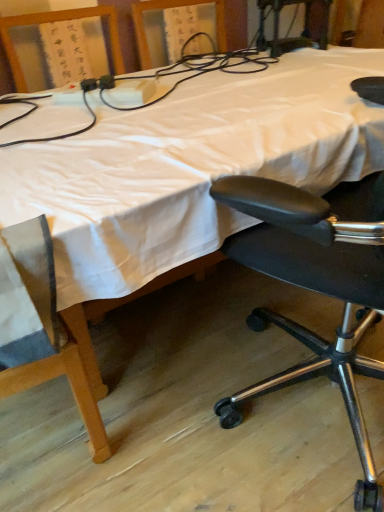
Question: From the image's perspective, would you say black leather office chair at right is positioned over white plastic power strip at upper left?

Choices:
 (A) no
 (B) yes

Answer: (A)

Question: Is black leather office chair at right positioned behind white plastic power strip at upper left?

Choices:
 (A) yes
 (B) no

Answer: (B)

Question: Is black leather office chair at right to the right of white plastic power strip at upper left from the viewer's perspective?

Choices:
 (A) yes
 (B) no

Answer: (A)

Question: Is black leather office chair at right completely or partially outside of white plastic power strip at upper left?

Choices:
 (A) yes
 (B) no

Answer: (A)

Question: Considering the relative sizes of black leather office chair at right and white plastic power strip at upper left in the image provided, is black leather office chair at right wider than white plastic power strip at upper left?

Choices:
 (A) yes
 (B) no

Answer: (A)

Question: Does black leather office chair at right have a lesser width compared to white plastic power strip at upper left?

Choices:
 (A) no
 (B) yes

Answer: (A)

Question: Does white plastic power strip at upper left appear on the left side of black leather office chair at right?

Choices:
 (A) no
 (B) yes

Answer: (B)

Question: Can you confirm if white plastic power strip at upper left is bigger than black leather office chair at right?

Choices:
 (A) yes
 (B) no

Answer: (B)

Question: Is white plastic power strip at upper left not inside black leather office chair at right?

Choices:
 (A) no
 (B) yes

Answer: (B)

Question: From the image's perspective, is white plastic power strip at upper left above black leather office chair at right?

Choices:
 (A) no
 (B) yes

Answer: (B)

Question: Can you confirm if white plastic power strip at upper left is positioned to the right of black leather office chair at right?

Choices:
 (A) yes
 (B) no

Answer: (B)

Question: Can you confirm if white plastic power strip at upper left is thinner than black leather office chair at right?

Choices:
 (A) yes
 (B) no

Answer: (A)

Question: From a real-world perspective, is white fabric bed at center positioned under black leather office chair at right based on gravity?

Choices:
 (A) yes
 (B) no

Answer: (A)